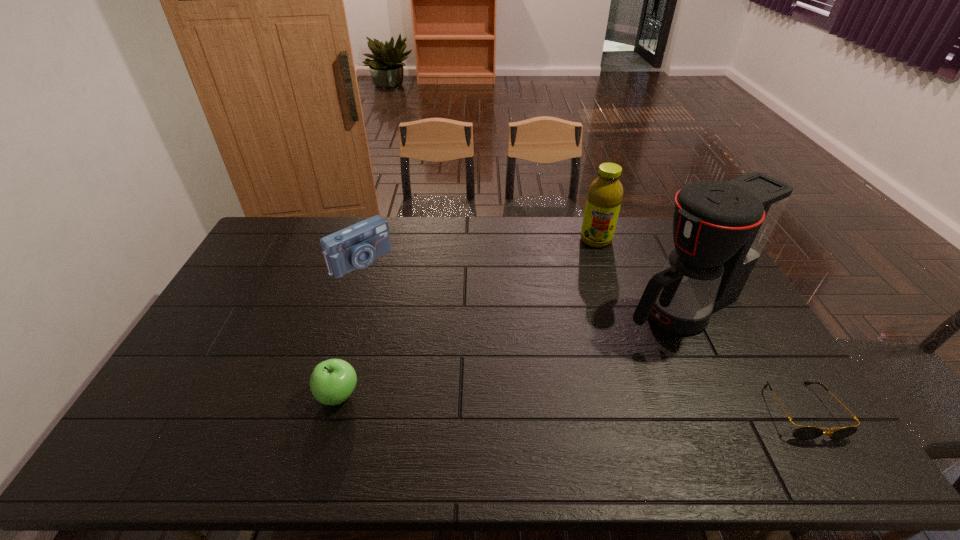
Locate an element on the screen. Image resolution: width=960 pixels, height=540 pixels. free location that satisfies the following two spatial constraints: 1. on the back side of the fourth shortest object; 2. on the left side of the apple is located at coordinates (382, 240).

I want to click on vacant region that satisfies the following two spatial constraints: 1. on the back side of the camera; 2. on the left side of the second tallest object, so click(368, 240).

Find the location of `vacant region that satisfies the following two spatial constraints: 1. on the back side of the fourth shortest object; 2. on the right side of the apple`. vacant region that satisfies the following two spatial constraints: 1. on the back side of the fourth shortest object; 2. on the right side of the apple is located at coordinates (382, 240).